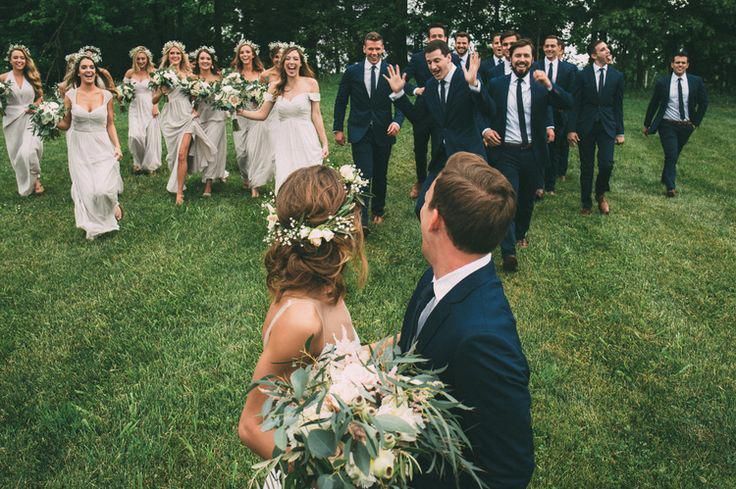
I want to click on bouquets, so click(360, 419), click(4, 92), click(40, 116), click(124, 94), click(163, 78), click(198, 91), click(222, 95), click(252, 94).